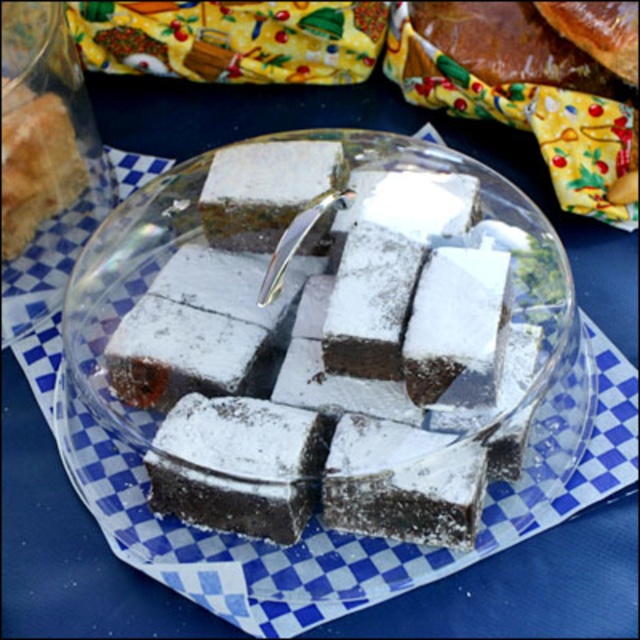
How distant is powdered chocolate cake at center from yellow fabric at upper center?

A distance of 4.61 inches exists between powdered chocolate cake at center and yellow fabric at upper center.

Is point (234, 465) closer to camera compared to point (102, 42)?

Yes, point (234, 465) is closer to viewer.

The height and width of the screenshot is (640, 640). Identify the location of powdered chocolate cake at center. (330, 406).

Is yellow fabric at upper center above white powdered cake at center?

Indeed, yellow fabric at upper center is positioned over white powdered cake at center.

Can you confirm if yellow fabric at upper center is shorter than white powdered cake at center?

Correct, yellow fabric at upper center is not as tall as white powdered cake at center.

Describe the element at coordinates (230, 38) in the screenshot. I see `yellow fabric at upper center` at that location.

Identify the location of yellow fabric at upper center. (230, 38).

Is powdered chocolate cake at center taller than white powdered cake at center?

Indeed, powdered chocolate cake at center has a greater height compared to white powdered cake at center.

Which of these two, powdered chocolate cake at center or white powdered cake at center, stands taller?

Standing taller between the two is powdered chocolate cake at center.

Is point (404, 333) closer to camera compared to point (22, 214)?

That is True.

In order to click on powdered chocolate cake at center in this screenshot , I will do `click(330, 406)`.